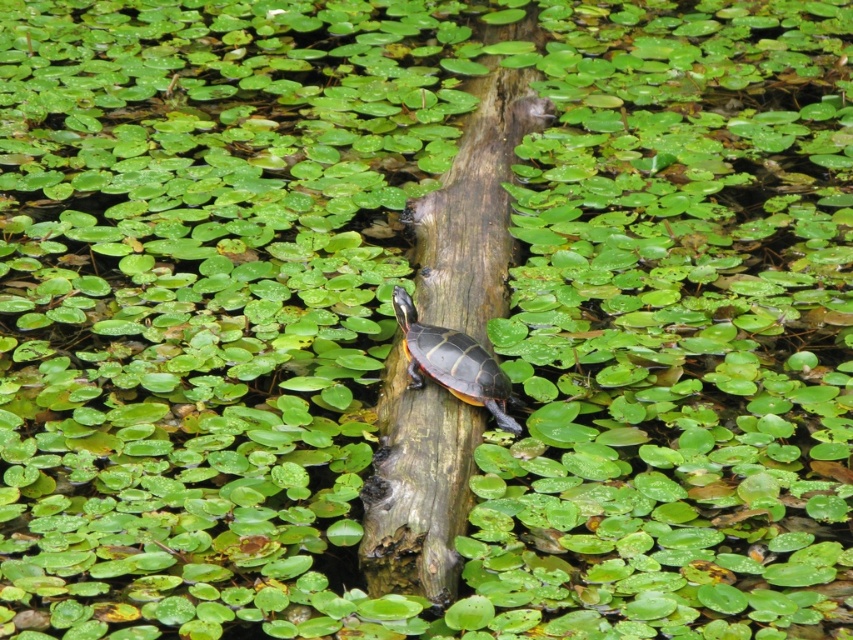
Is brown rough wood at center thinner than shiny brown tortoise at center?

In fact, brown rough wood at center might be wider than shiny brown tortoise at center.

Where is `brown rough wood at center`? brown rough wood at center is located at coordinates (416, 486).